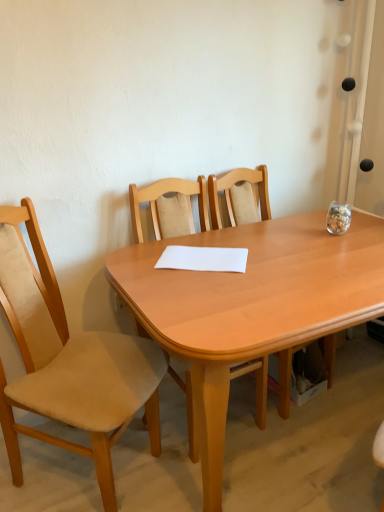
You are a GUI agent. You are given a task and a screenshot of the screen. Output one action in this format:
    pyautogui.click(x=<x>, y=<y>)
    Task: Click on the free point below beige fabric chair at left, the first chair when ordered from left to right (from a real-world perspective)
    This screenshot has height=512, width=384.
    Given the screenshot: What is the action you would take?
    pyautogui.click(x=73, y=481)